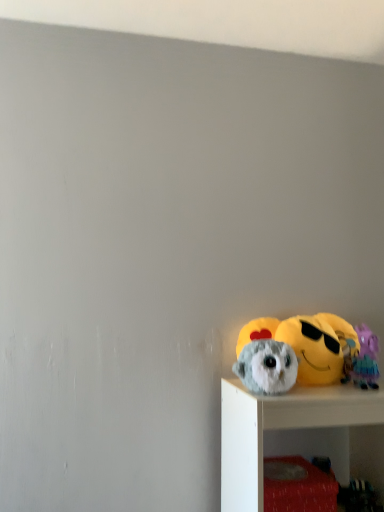
Question: From the image's perspective, is purple plush toy at right, which is the third toy in left-to-right order, on fluffy gray plush at lower right, the third toy positioned from the right?

Choices:
 (A) yes
 (B) no

Answer: (A)

Question: Is purple plush toy at right, which is the third toy in left-to-right order, facing away from fluffy gray plush at lower right, the third toy positioned from the right?

Choices:
 (A) no
 (B) yes

Answer: (A)

Question: Is purple plush toy at right, the first toy positioned from the right, smaller than fluffy gray plush at lower right, positioned as the first toy in left-to-right order?

Choices:
 (A) yes
 (B) no

Answer: (A)

Question: Would you say purple plush toy at right, which is the third toy in left-to-right order, is a long distance from fluffy gray plush at lower right, positioned as the first toy in left-to-right order?

Choices:
 (A) yes
 (B) no

Answer: (B)

Question: Is fluffy gray plush at lower right, positioned as the first toy in left-to-right order, inside purple plush toy at right, the first toy positioned from the right?

Choices:
 (A) no
 (B) yes

Answer: (A)

Question: From a real-world perspective, does purple plush toy at right, which is the third toy in left-to-right order, stand above fluffy gray plush at lower right, positioned as the first toy in left-to-right order?

Choices:
 (A) yes
 (B) no

Answer: (A)

Question: Is fluffy gray plush at lower right, positioned as the first toy in left-to-right order, completely or partially outside of purple plush toy at right, the first toy positioned from the right?

Choices:
 (A) no
 (B) yes

Answer: (B)

Question: From a real-world perspective, does fluffy gray plush at lower right, the third toy positioned from the right, sit lower than purple plush toy at right, the first toy positioned from the right?

Choices:
 (A) yes
 (B) no

Answer: (A)

Question: Does fluffy gray plush at lower right, positioned as the first toy in left-to-right order, have a greater height compared to purple plush toy at right, which is the third toy in left-to-right order?

Choices:
 (A) no
 (B) yes

Answer: (A)

Question: Is fluffy gray plush at lower right, positioned as the first toy in left-to-right order, at the right side of purple plush toy at right, the first toy positioned from the right?

Choices:
 (A) no
 (B) yes

Answer: (A)

Question: From the image's perspective, does fluffy gray plush at lower right, the third toy positioned from the right, appear higher than purple plush toy at right, the first toy positioned from the right?

Choices:
 (A) yes
 (B) no

Answer: (B)

Question: Is fluffy gray owl at lower right, which is counted as the second toy, starting from the left, further to camera compared to purple plush toy at right, which is the third toy in left-to-right order?

Choices:
 (A) yes
 (B) no

Answer: (A)